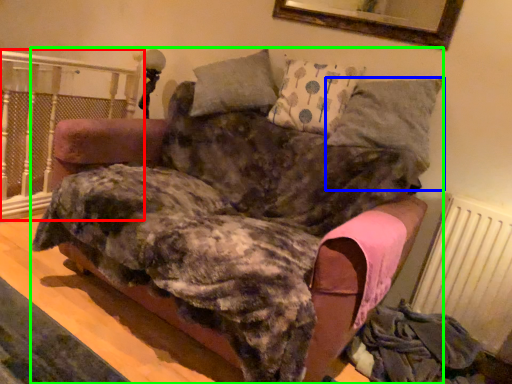
Question: Considering the real-world distances, which object is farthest from rail (highlighted by a red box)? pillow (highlighted by a blue box) or furniture (highlighted by a green box)?

Choices:
 (A) pillow
 (B) furniture

Answer: (A)